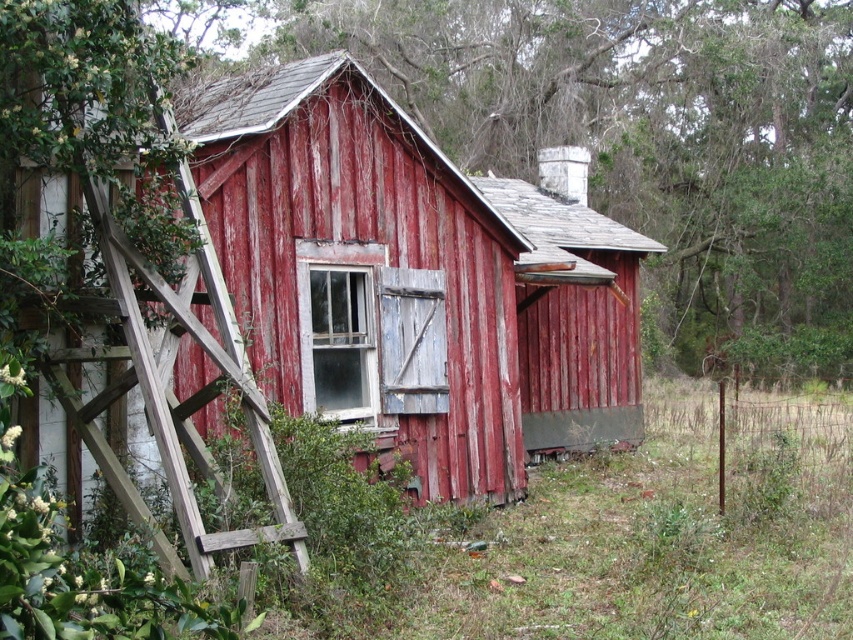
From the picture: You are a painter standing in front of the rusty wood barn at center and the smooth wooden fence at center. You need to paint both structures. Which one will require you to use a ladder to reach the top?

The smooth wooden fence at center is taller than the rusty wood barn at center, so you will need a ladder to paint the smooth wooden fence at center.